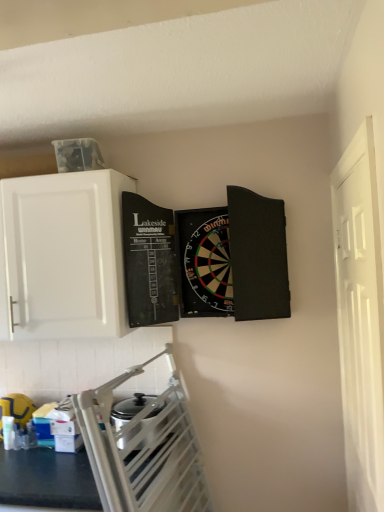
This screenshot has width=384, height=512. What do you see at coordinates (65, 254) in the screenshot?
I see `white matte cabinet at upper left` at bounding box center [65, 254].

Looking at this image, measure the distance between point (71, 194) and camera.

A distance of 1.80 meters exists between point (71, 194) and camera.

You are a GUI agent. You are given a task and a screenshot of the screen. Output one action in this format:
    pyautogui.click(x=<x>, y=<y>)
    Task: Click on the white matte cabinet at upper left
    The height and width of the screenshot is (512, 384).
    Given the screenshot: What is the action you would take?
    pyautogui.click(x=65, y=254)

Identify the location of white matte cabinet at upper left. This screenshot has height=512, width=384. (x=65, y=254).